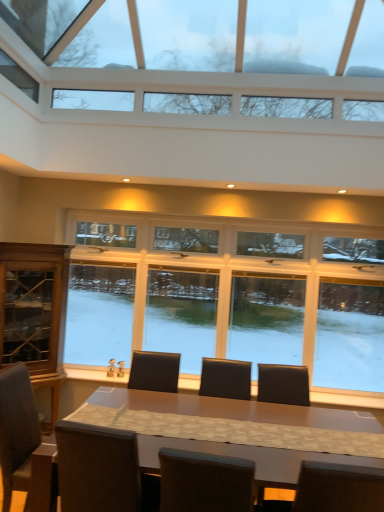
Question: Considering the positions of dark brown leather armchair at center and dark brown leather chair at lower left in the image, is dark brown leather armchair at center taller or shorter than dark brown leather chair at lower left?

Choices:
 (A) tall
 (B) short

Answer: (B)

Question: Is dark brown leather armchair at center in front of or behind dark brown leather chair at lower left in the image?

Choices:
 (A) front
 (B) behind

Answer: (B)

Question: Estimate the real-world distances between objects in this image. Which object is farther from the clear glass windows at upper center, which is counted as the 2th window, starting from the bottom?

Choices:
 (A) matte brown table at center
 (B) dark brown leather armchair at center
 (C) dark brown leather chair at lower left
 (D) clear glass windows at center, the second window from the top

Answer: (A)

Question: Which of these objects is positioned farthest from the clear glass windows at center, the second window from the top?

Choices:
 (A) matte brown table at center
 (B) dark brown leather armchair at center
 (C) dark brown leather chair at lower left
 (D) clear glass windows at upper center, which is the 1th window from top to bottom

Answer: (D)